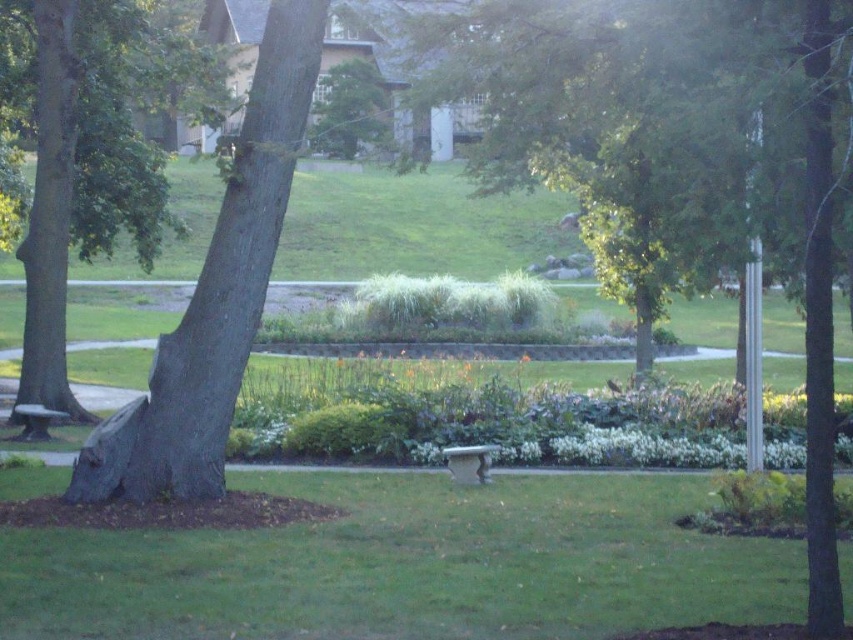
Question: Observing the image, what is the correct spatial positioning of green grass at center in reference to smooth gray tree trunk at left?

Choices:
 (A) left
 (B) right

Answer: (A)

Question: Is green grass at center to the left of smooth gray stone bench at lower left from the viewer's perspective?

Choices:
 (A) yes
 (B) no

Answer: (B)

Question: Which point is closer to the camera?

Choices:
 (A) (483, 449)
 (B) (381, 106)

Answer: (A)

Question: Among these points, which one is nearest to the camera?

Choices:
 (A) (310, 134)
 (B) (33, 432)
 (C) (461, 445)

Answer: (A)

Question: Considering the relative positions of green grass at center and green leafy tree at upper center in the image provided, where is green grass at center located with respect to green leafy tree at upper center?

Choices:
 (A) above
 (B) below

Answer: (B)

Question: Among these points, which one is nearest to the camera?

Choices:
 (A) (347, 150)
 (B) (538, 60)
 (C) (28, 420)

Answer: (B)